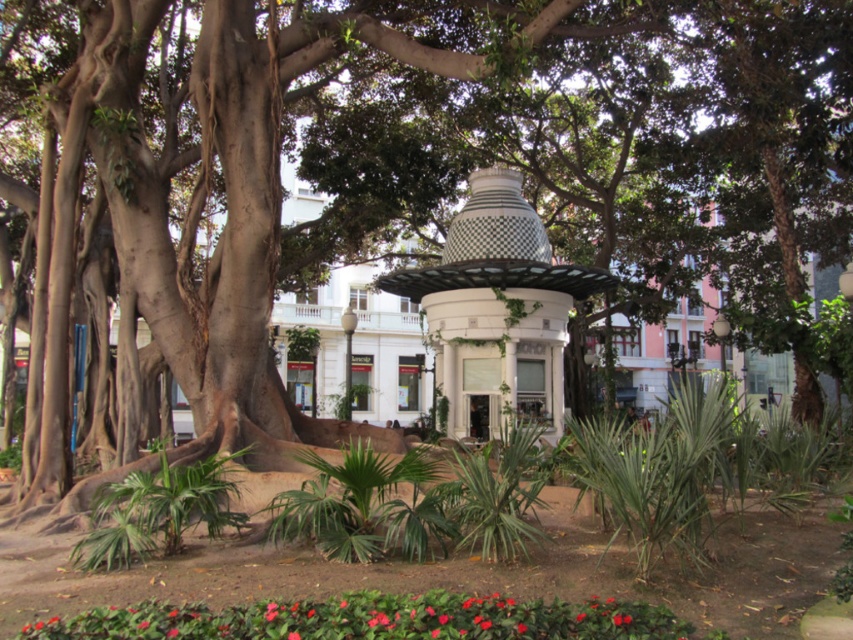
Who is more forward, (560, 356) or (535, 602)?

Positioned in front is point (535, 602).

Between white mosaic gazebo at center and smooth glossy red flower at lower center, which one has more height?

With more height is white mosaic gazebo at center.

What do you see at coordinates (497, 310) in the screenshot? I see `white mosaic gazebo at center` at bounding box center [497, 310].

This screenshot has width=853, height=640. Find the location of `white mosaic gazebo at center`. white mosaic gazebo at center is located at coordinates (497, 310).